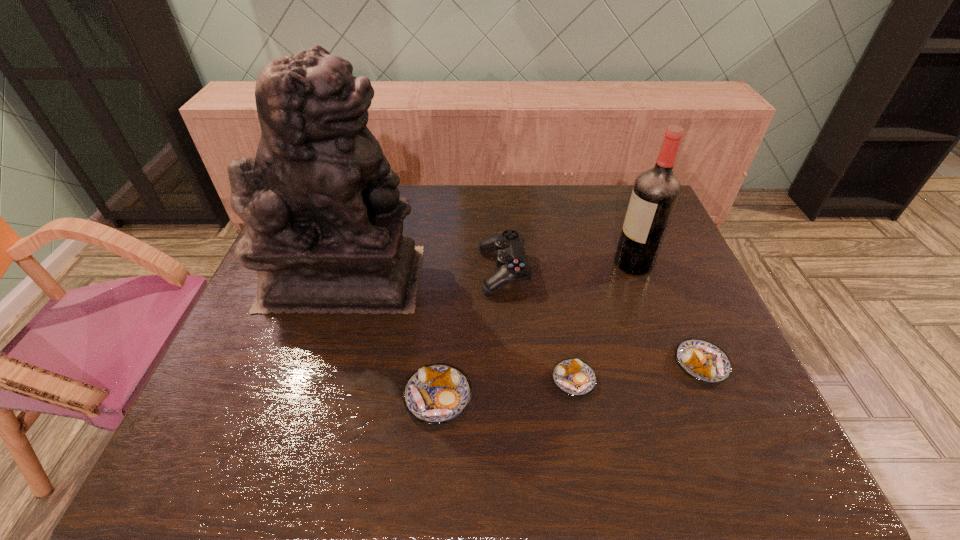
The height and width of the screenshot is (540, 960). Find the location of `free space between the shortest object and the leftmost object`. free space between the shortest object and the leftmost object is located at coordinates (459, 329).

Where is `vacant area between the second shortest object and the shortest pastry`? This screenshot has height=540, width=960. vacant area between the second shortest object and the shortest pastry is located at coordinates (637, 372).

Find the location of `vacant area that lies between the fourth tallest object and the fourth object from right to left`. vacant area that lies between the fourth tallest object and the fourth object from right to left is located at coordinates (470, 334).

The height and width of the screenshot is (540, 960). I want to click on empty space between the sculpture and the fifth object from right to left, so click(391, 337).

In order to click on vacant area that lies between the fourth shortest object and the second shortest object in this screenshot , I will do `click(602, 318)`.

This screenshot has height=540, width=960. What are the coordinates of `free space that is in between the shortest pastry and the second tallest object` in the screenshot? It's located at (604, 321).

Find the location of a particular element. The image size is (960, 540). free space between the leftmost pastry and the second pastry from right to left is located at coordinates (506, 388).

Select which object appears as the fourth closest to the third object from right to left. Please provide its 2D coordinates. Your answer should be formatted as a tuple, i.e. [(x, y)], where the tuple contains the x and y coordinates of a point satisfying the conditions above.

[(656, 191)]

Locate which object ranks fourth in proximity to the tallest pastry. Please provide its 2D coordinates. Your answer should be formatted as a tuple, i.e. [(x, y)], where the tuple contains the x and y coordinates of a point satisfying the conditions above.

[(702, 360)]

Where is `pastry identified as the second closest to the tallest object`? This screenshot has height=540, width=960. pastry identified as the second closest to the tallest object is located at coordinates (574, 377).